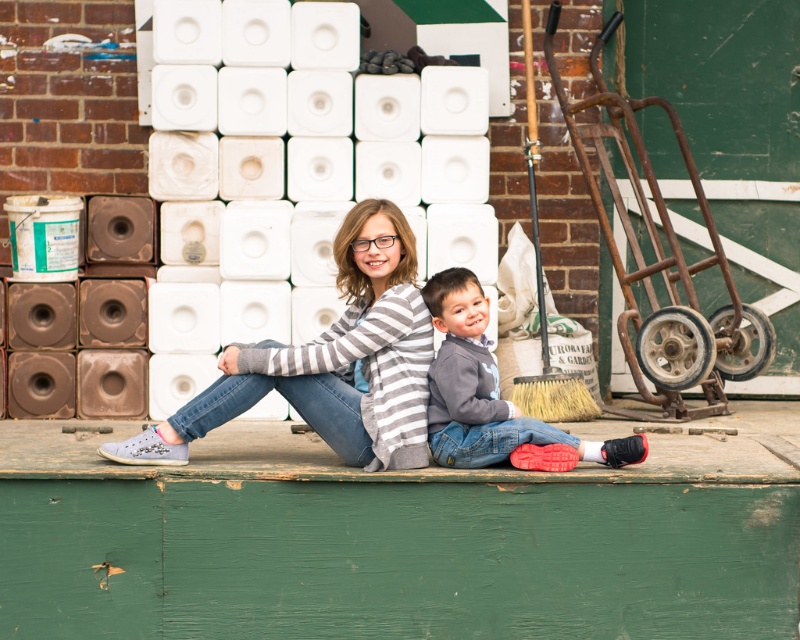
You are a photographer trying to capture both the striped sweater at center and the gray fleece sweater at center in a single shot. Which sweater should you focus on first to ensure both are in focus?

You should focus on the striped sweater at center first because it is closer to the viewer than the gray fleece sweater at center, ensuring both will be in focus when using depth of field appropriately.

You are a photographer trying to capture both the striped sweater at center and the gray fleece sweater at center in a single frame. Based on their sizes, which sweater should you focus on to ensure both fit in the photo?

Result: The striped sweater at center is wider than the gray fleece sweater at center, so focusing on the wider striped sweater at center will help ensure both fit in the photo.

In the scene shown: You are a photographer trying to capture a photo of the green painted wood at center and the gray fleece sweater at center. Since both are in the same general area, will you need to adjust your camera focus to capture both clearly?

The green painted wood at center is in front of the gray fleece sweater at center, so you will need to adjust your camera focus to ensure both are in focus since they are at different distances from the camera.